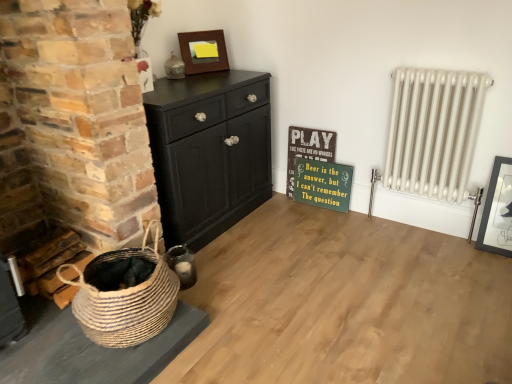
The height and width of the screenshot is (384, 512). What are the coordinates of `free space to the left of white metal radiator at right` in the screenshot? It's located at [351, 233].